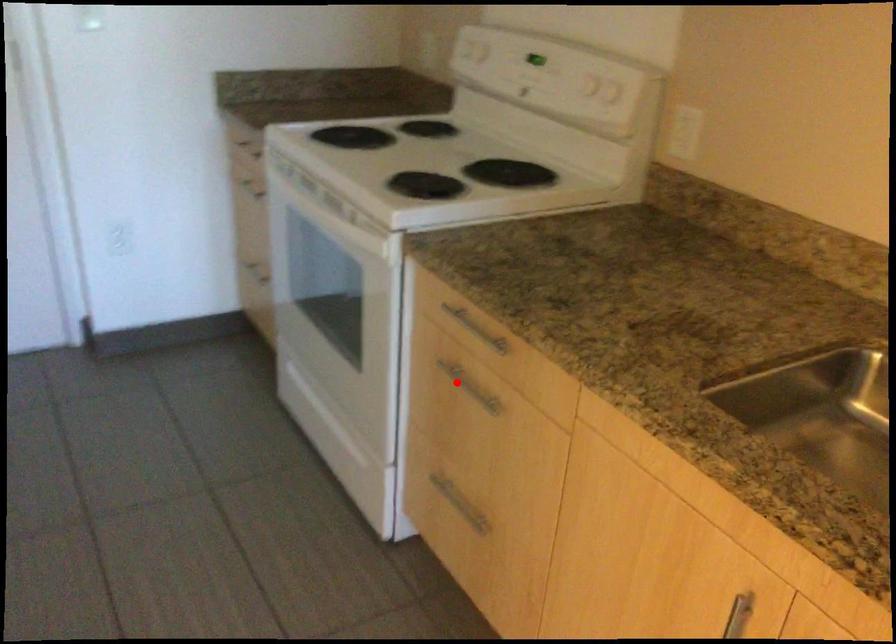
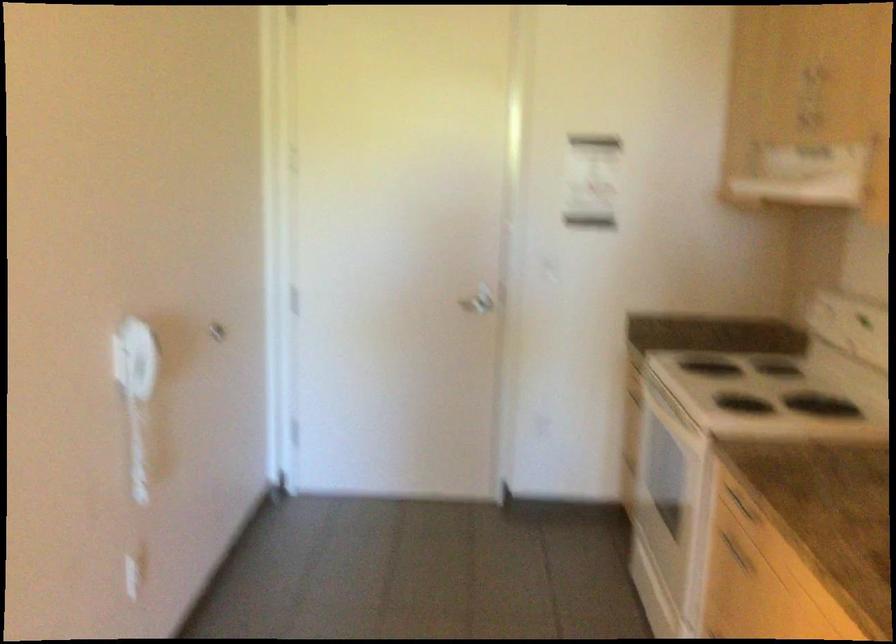
Where in the second image is the point corresponding to the highlighted location from the first image?

(735, 552)